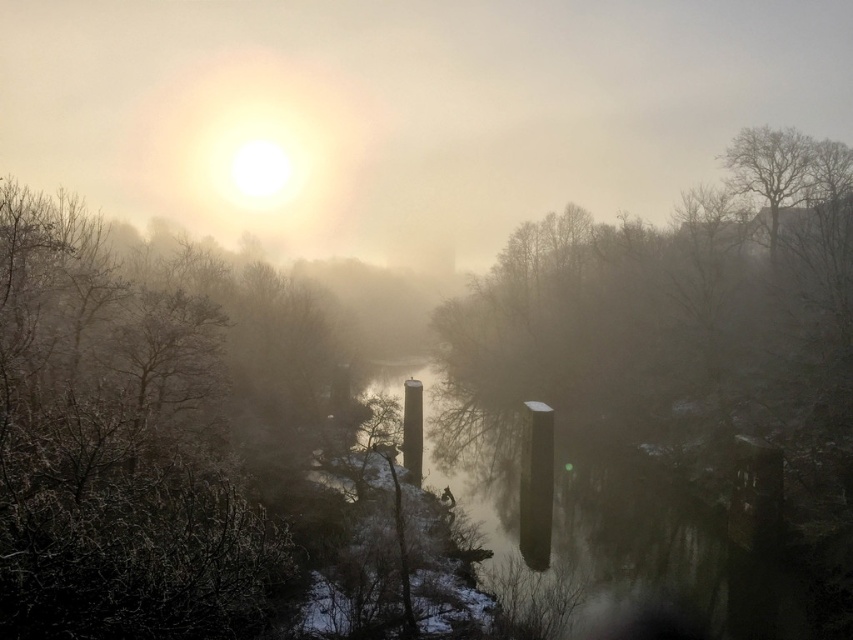
You are standing in the winter scene and want to walk from the smooth bark tree at center to the smooth concrete pillars at center. Which direction should you move to reach them?

You should move away from the viewer because the smooth concrete pillars at center are further away than the smooth bark tree at center.

You are a photographer aiming to capture the frosted brown tree at upper left and the smooth concrete pillars at center in a single shot. Based on their positions, which object appears higher in the image?

The frosted brown tree at upper left appears higher in the image because it is located above the smooth concrete pillars at center.

You are a photographer planning to capture the frosted brown tree at upper left and the smooth concrete pillars at center in a single frame. Based on their sizes, which object would appear more prominent in the photo?

The frosted brown tree at upper left would appear more prominent in the photo since it has a larger size compared to the smooth concrete pillars at center.